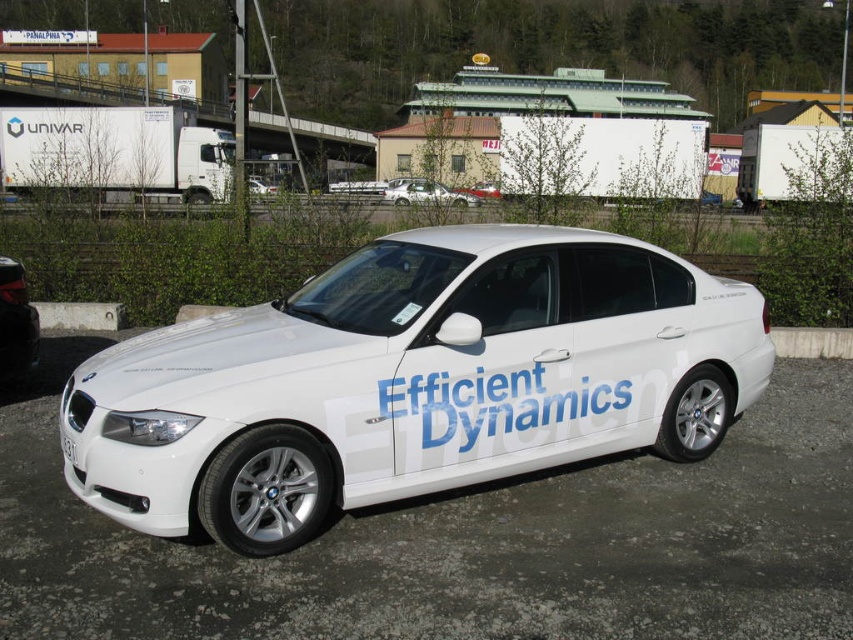
You are a delivery driver who needs to park your truck between the white concrete curb at lower right and the gray concrete curb at lower left. Can you fit your truck between them?

The white concrete curb at lower right is below the gray concrete curb at lower left, so the vertical distance between them may not be sufficient for parking a truck. You should check the space between them for adequate clearance.

Based on the photo, you are a delivery driver trying to read the license plate of the silver metallic sedan at center. From your current position, can you see the white plastic license plate at center clearly?

The silver metallic sedan at center is located above the white plastic license plate at center, so yes, you can see the white plastic license plate at center clearly from your current position.

You are standing at the point closest to the BMW sedan. Which of the two points, point (10, 365) or point (123, 317), is closer to you?

Point (10, 365) is in front of point (123, 317), so it is closer to you.